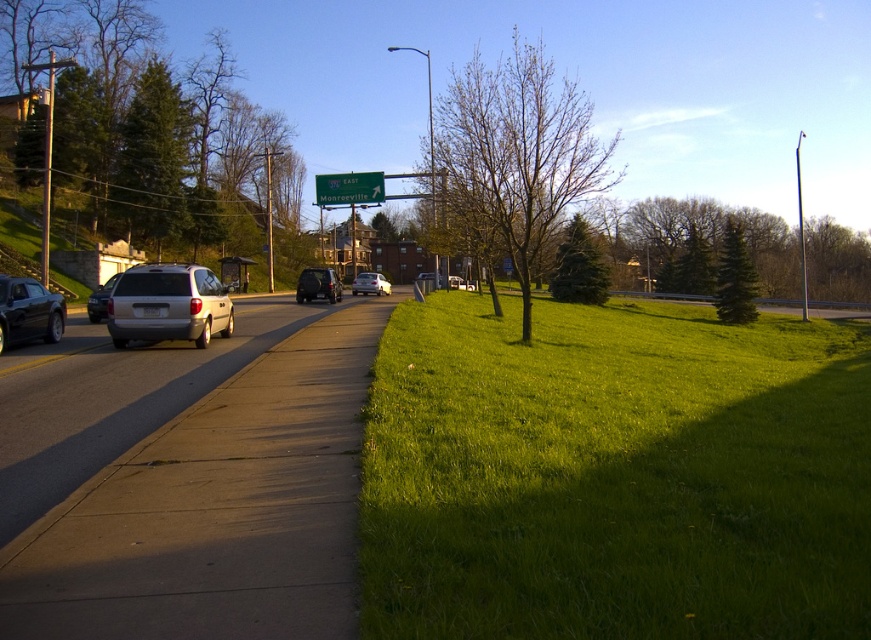
Question: Does bare brown tree at center have a greater width compared to silver metallic minivan at center-left?

Choices:
 (A) no
 (B) yes

Answer: (B)

Question: Which object appears farthest from the camera in this image?

Choices:
 (A) satin silver minivan at center-left
 (B) silver metallic minivan at center-left

Answer: (A)

Question: Which point appears farthest from the camera in this image?

Choices:
 (A) (91, 296)
 (B) (451, 284)
 (C) (134, 45)
 (D) (90, 627)

Answer: (C)

Question: Estimate the real-world distances between objects in this image. Which object is closer to the concrete sidewalk at center?

Choices:
 (A) green grassy at lower right
 (B) shiny black car at left
 (C) bare brown tree at center

Answer: (A)

Question: Can you confirm if green leafy tree at upper left is smaller than green matte tree at center?

Choices:
 (A) yes
 (B) no

Answer: (B)

Question: Is green textured evergreen tree at right below silver metallic van at center?

Choices:
 (A) no
 (B) yes

Answer: (A)